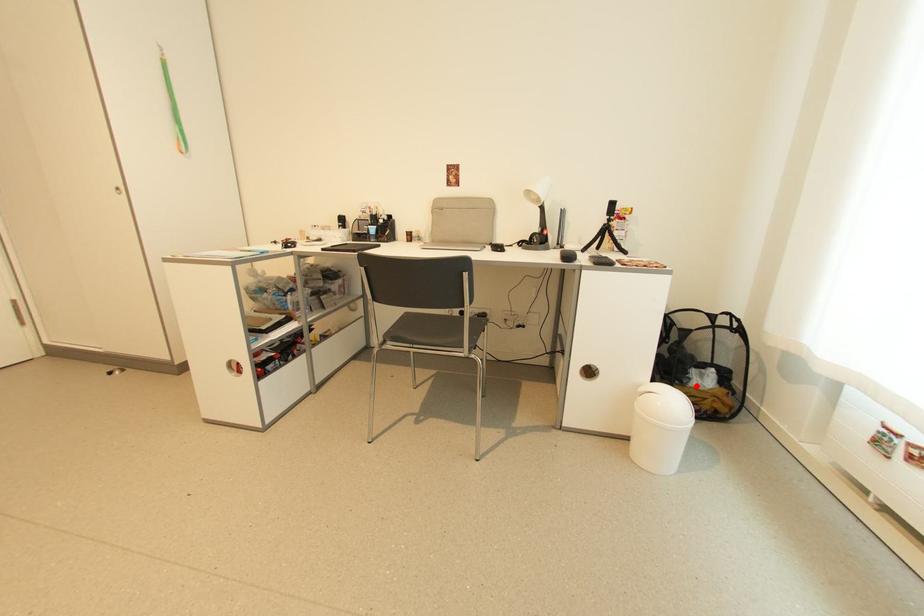
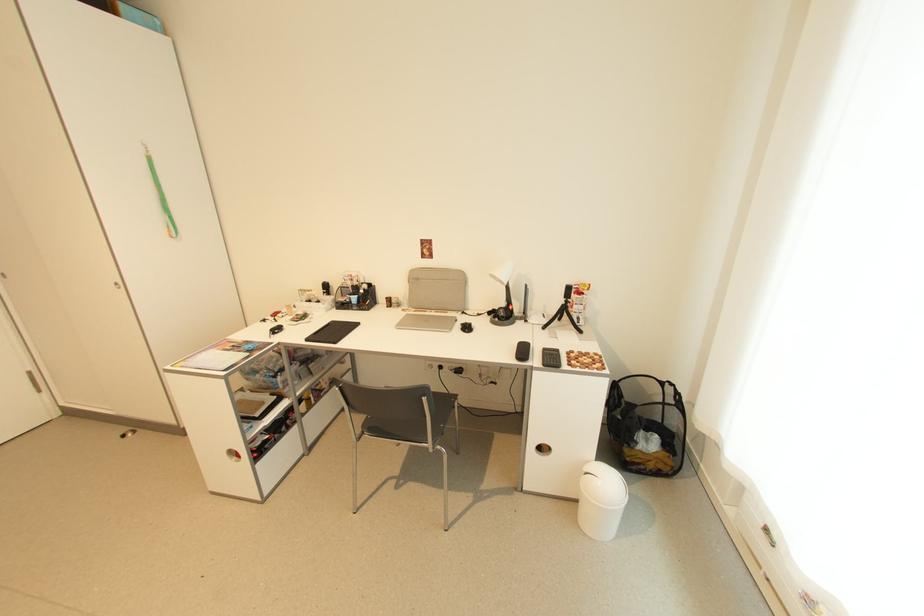
Find the pixel in the second image that matches the highlighted location in the first image.

(642, 450)